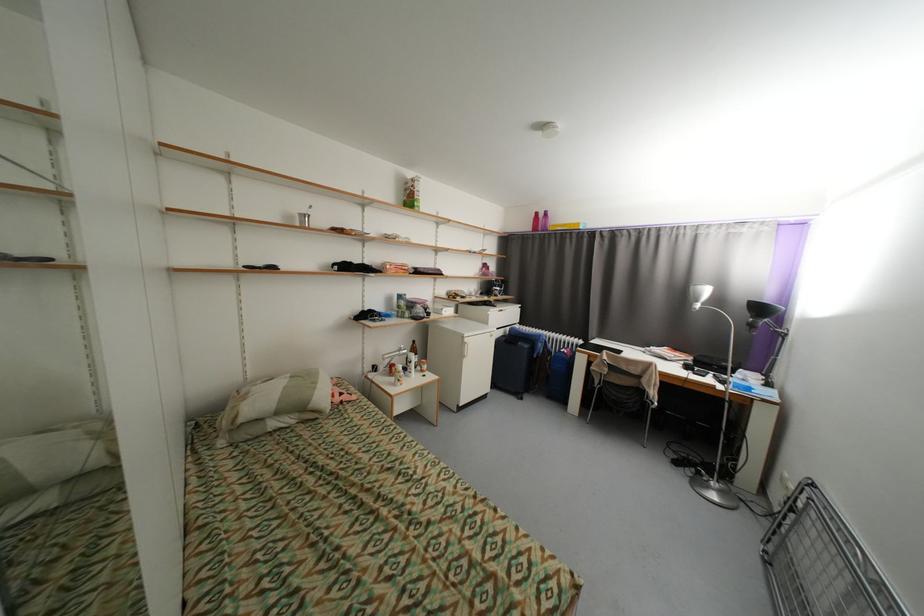
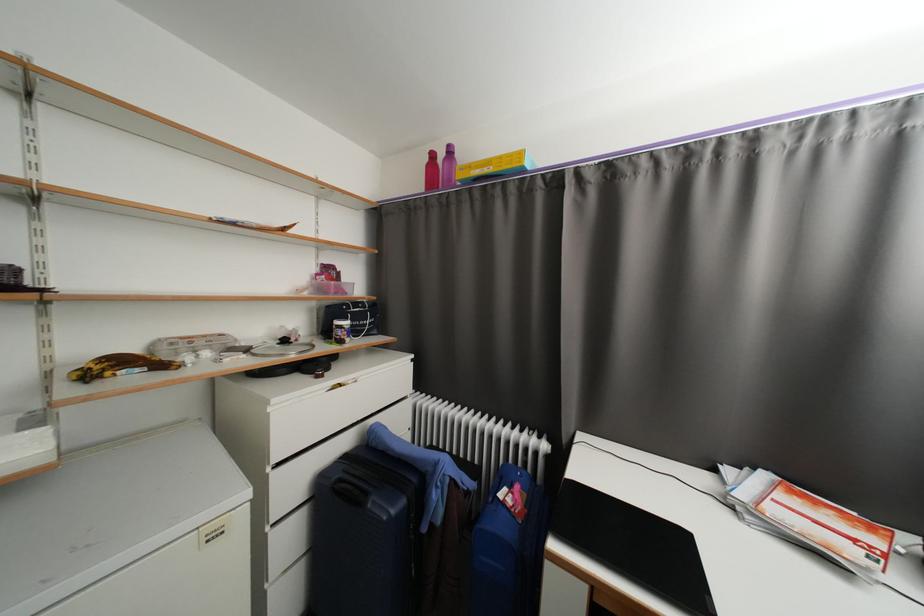
Where in the second image is the point corresponding to point 563,227 from the first image?

(476, 168)